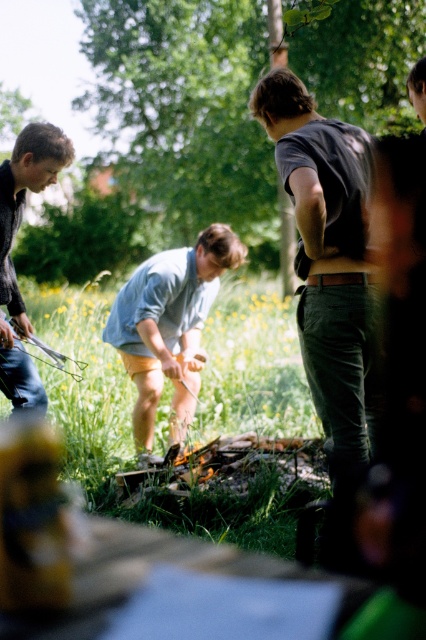
Question: Is dark gray t-shirt at center below matte black jacket at left?

Choices:
 (A) no
 (B) yes

Answer: (B)

Question: Does light blue denim shorts at center have a greater width compared to matte black jacket at left?

Choices:
 (A) no
 (B) yes

Answer: (B)

Question: Among these objects, which one is farthest from the camera?

Choices:
 (A) green grass at center
 (B) dark gray t-shirt at center
 (C) light blue denim shorts at center
 (D) matte black jacket at left

Answer: (C)

Question: Which point is farther to the camera?

Choices:
 (A) (276, 282)
 (B) (25, 316)
 (C) (224, 264)
 (D) (339, 429)

Answer: (A)

Question: Which is nearer to the matte black jacket at left?

Choices:
 (A) green grass at center
 (B) dark gray t-shirt at center

Answer: (B)

Question: Is green grass at center to the right of matte black jacket at left from the viewer's perspective?

Choices:
 (A) no
 (B) yes

Answer: (B)